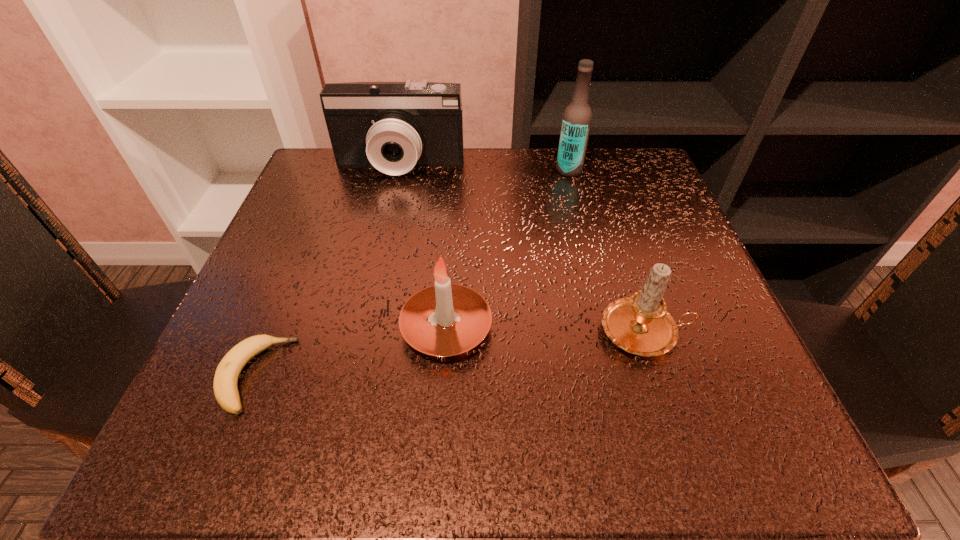
Where is `free location located 0.130m on the left of the right candle`? This screenshot has height=540, width=960. free location located 0.130m on the left of the right candle is located at coordinates [x=516, y=333].

Find the location of a particular element. blank area located on the right of the banana is located at coordinates (358, 375).

Identify the location of beer bottle positioned at the far edge. (577, 118).

In order to click on camcorder present at the far edge in this screenshot , I will do `click(392, 126)`.

I want to click on object that is positioned at the near edge, so click(225, 387).

Identify the location of camcorder that is at the left edge. (392, 126).

Where is `banana that is at the left edge`? Image resolution: width=960 pixels, height=540 pixels. banana that is at the left edge is located at coordinates pos(225,387).

Where is `beer bottle that is at the right edge`? This screenshot has height=540, width=960. beer bottle that is at the right edge is located at coordinates (577, 118).

This screenshot has width=960, height=540. What are the coordinates of `candle that is at the right edge` in the screenshot? It's located at (640, 324).

Where is `object that is at the far left corner`? The width and height of the screenshot is (960, 540). object that is at the far left corner is located at coordinates (392, 126).